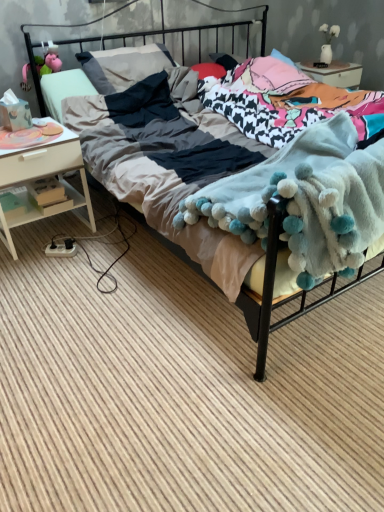
Question: From the image's perspective, relative to wooden boxes at left, is white wood nightstand at left above or below?

Choices:
 (A) below
 (B) above

Answer: (B)

Question: Do you think white wood nightstand at left is within wooden boxes at left, or outside of it?

Choices:
 (A) inside
 (B) outside

Answer: (B)

Question: Which object is the farthest from the wooden boxes at left?

Choices:
 (A) fluffy white blanket at center
 (B) white wood nightstand at left
 (C) soft cotton bed at center

Answer: (A)

Question: Which object is positioned farthest from the soft cotton bed at center?

Choices:
 (A) wooden boxes at left
 (B) white wood nightstand at left
 (C) fluffy white blanket at center

Answer: (C)